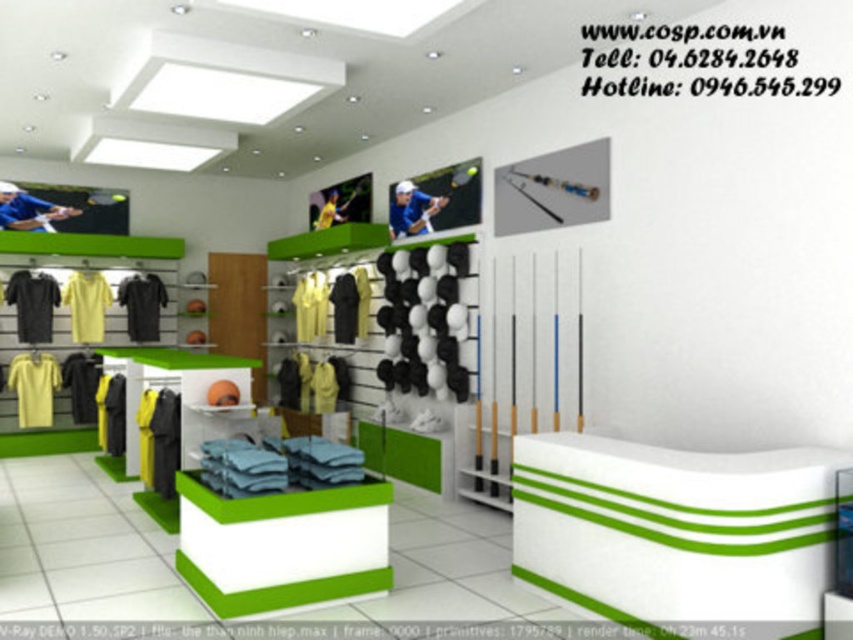
Question: Is matte yellow t-shirt at left positioned before black matte t-shirt at left?

Choices:
 (A) yes
 (B) no

Answer: (A)

Question: Which of the following is the farthest from the observer?

Choices:
 (A) blue fabric shirt at center
 (B) yellow matte t-shirt at center

Answer: (B)

Question: Based on their relative distances, which object is nearer to the black matte t-shirt at center?

Choices:
 (A) matte blue shirt at center
 (B) black matte t-shirt at left
 (C) dark gray fabric jacket at center
 (D) blue fabric shirt at center

Answer: (B)

Question: Which point is farther to the camera?

Choices:
 (A) black matte t-shirt at center
 (B) blue fabric shirt at center

Answer: (A)

Question: Does yellow matte t-shirt at center have a smaller size compared to matte blue shirt at center?

Choices:
 (A) no
 (B) yes

Answer: (A)

Question: Is the position of yellow fabric at center less distant than that of blue fabric shirt at center?

Choices:
 (A) yes
 (B) no

Answer: (B)